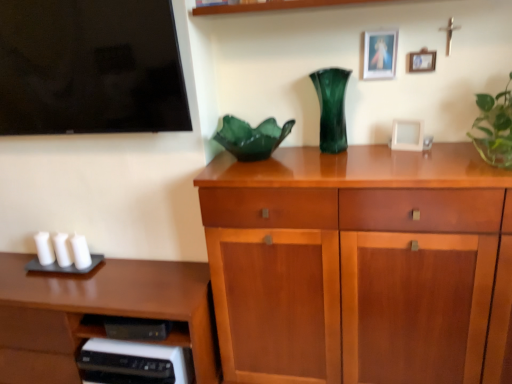
Locate an element on the screen. free point to the right of white matte picture frame at upper right, marked as the 1th picture frame in a bottom-to-top arrangement is located at coordinates (445, 143).